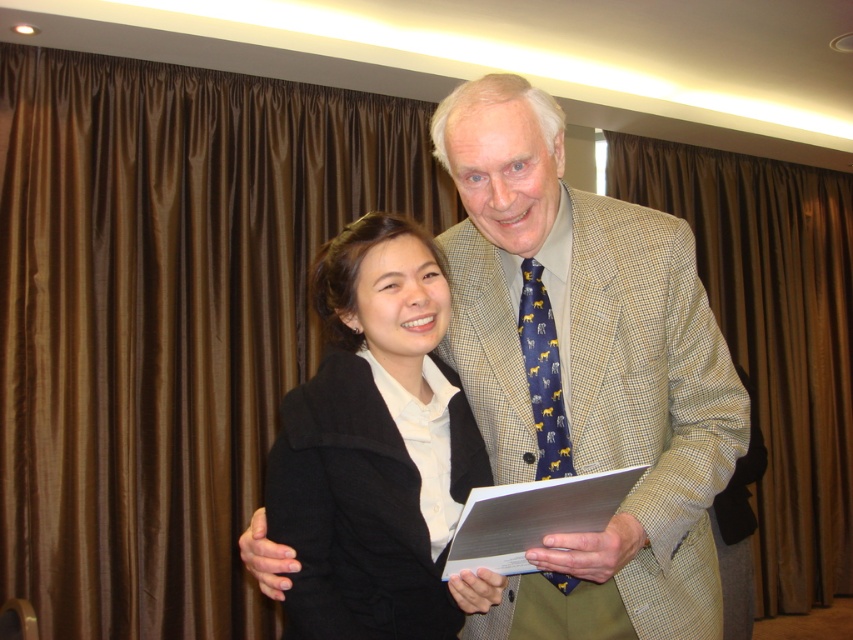
Question: Among these objects, which one is nearest to the camera?

Choices:
 (A) brown satin curtain at left
 (B) light beige textured blazer at center
 (C) black woolen coat at center
 (D) navy blue silk tie at center

Answer: (C)

Question: Is black woolen coat at center to the right of navy blue silk tie at center from the viewer's perspective?

Choices:
 (A) yes
 (B) no

Answer: (B)

Question: Which object is farther from the camera taking this photo?

Choices:
 (A) navy blue silk tie at center
 (B) brown satin curtain at left
 (C) light beige textured blazer at center

Answer: (B)

Question: From the image, what is the correct spatial relationship of black woolen coat at center in relation to brown silk curtain at right?

Choices:
 (A) right
 (B) left

Answer: (B)

Question: Is light beige textured blazer at center smaller than navy blue silk tie at center?

Choices:
 (A) yes
 (B) no

Answer: (B)

Question: Which object is farther from the camera taking this photo?

Choices:
 (A) light beige textured blazer at center
 (B) navy blue silk tie at center

Answer: (B)